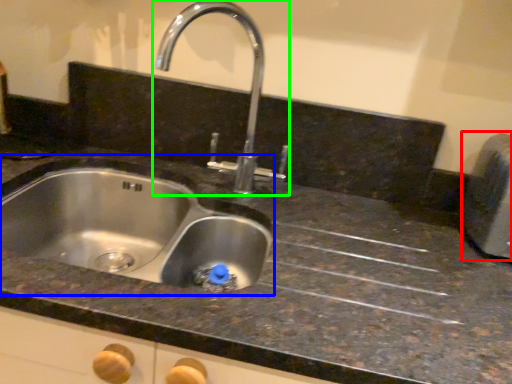
Question: Based on their relative distances, which object is farther from appliance (highlighted by a red box)? Choose from sink (highlighted by a blue box) and tap (highlighted by a green box).

Choices:
 (A) sink
 (B) tap

Answer: (A)